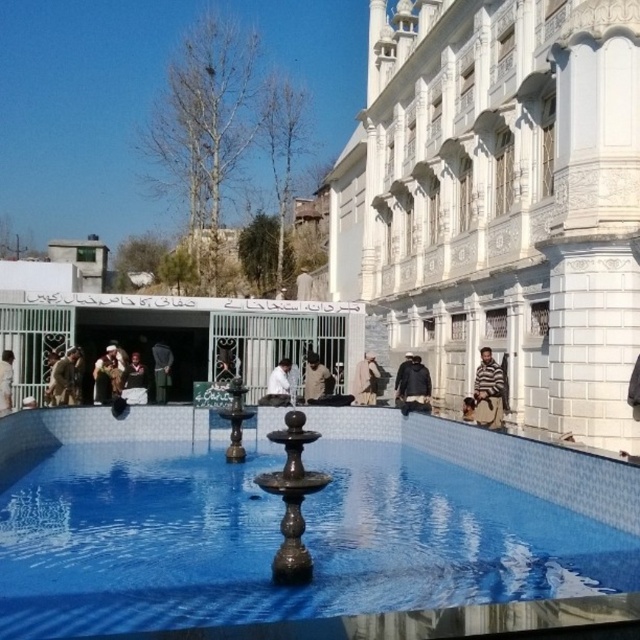
Locate an element on the screen. The image size is (640, 640). dark green fabric at center is located at coordinates (161, 369).

Is dark green fabric at center behind striped sweater at right?

That is True.

Is point (156, 372) less distant than point (467, 404)?

No, it is behind (467, 404).

Image resolution: width=640 pixels, height=640 pixels. In order to click on dark green fabric at center in this screenshot , I will do `click(161, 369)`.

Who is positioned more to the right, camouflage fabric jacket at left or striped sweater at right?

Positioned to the right is striped sweater at right.

You are a GUI agent. You are given a task and a screenshot of the screen. Output one action in this format:
    pyautogui.click(x=<x>, y=<y>)
    Task: Click on the camouflage fabric jacket at left
    
    Given the screenshot: What is the action you would take?
    pyautogui.click(x=64, y=380)

Between dark brown leather jacket at lower left and dark green fabric at center, which one is positioned higher?

dark brown leather jacket at lower left

Who is positioned more to the right, dark brown leather jacket at lower left or dark green fabric at center?

dark green fabric at center is more to the right.

Locate an element on the screen. dark brown leather jacket at lower left is located at coordinates (106, 376).